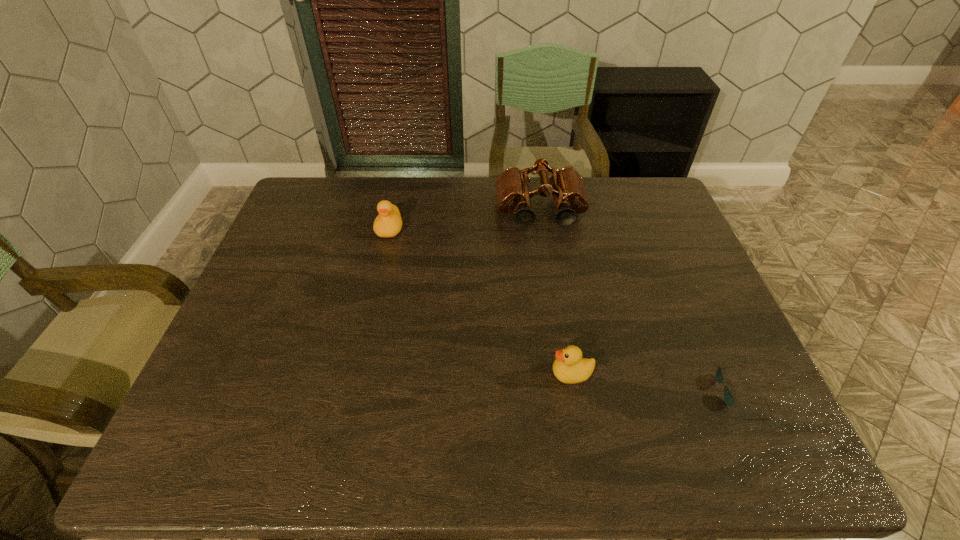
The image size is (960, 540). I want to click on the tallest object, so click(x=513, y=186).

Find the location of `the left duck`. the left duck is located at coordinates (388, 223).

The width and height of the screenshot is (960, 540). Identify the location of the farther duck. (388, 223).

The width and height of the screenshot is (960, 540). What are the coordinates of `the nearer duck` in the screenshot? It's located at (569, 367).

At what (x,y) coordinates should I click in order to perform the action: click on sunglasses. Please return your answer as a coordinate pair (x, y). Image resolution: width=960 pixels, height=540 pixels. Looking at the image, I should click on (728, 397).

Find the location of a particular element. The image size is (960, 540). the shortest object is located at coordinates (728, 397).

Identify the location of free location located 0.090m through the eyepieces of the tallest object. Image resolution: width=960 pixels, height=540 pixels. (546, 252).

Locate an element on the screen. blank area located on the face of the left duck is located at coordinates (380, 272).

This screenshot has height=540, width=960. Identify the location of free space located at the beak of the right duck. (490, 374).

Identify the location of vacant space located 0.270m at the beak of the right duck. The image size is (960, 540). [433, 374].